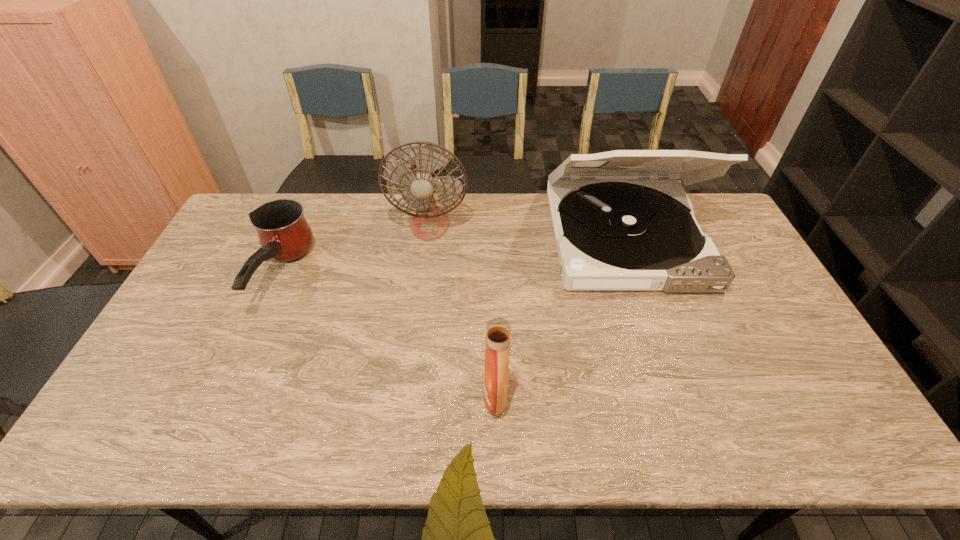
Where is `vacant space at the left edge of the desktop`? vacant space at the left edge of the desktop is located at coordinates (196, 301).

At what (x,y) coordinates should I click in order to perform the action: click on vacant space at the right edge of the desktop. Please return your answer as a coordinate pair (x, y). Looking at the image, I should click on (768, 316).

Where is `vacant space at the far left corner of the desktop`? vacant space at the far left corner of the desktop is located at coordinates (228, 235).

The width and height of the screenshot is (960, 540). Find the location of `vacant space that is in between the detergent and the rightmost object`. vacant space that is in between the detergent and the rightmost object is located at coordinates (561, 317).

Locate an element on the screen. This screenshot has width=960, height=540. free space between the third object from left to right and the rightmost object is located at coordinates (561, 317).

At what (x,y) coordinates should I click in order to perform the action: click on unoccupied position between the detergent and the third object from right to left. Please return your answer as a coordinate pair (x, y). The image size is (960, 540). Looking at the image, I should click on (463, 309).

Find the location of a particular element. The image size is (960, 540). free space between the third object from left to right and the CD player is located at coordinates (561, 317).

Locate an element on the screen. free spot between the detergent and the fan is located at coordinates (463, 309).

Find the location of `vacant area that lies between the rightmost object and the shortest object`. vacant area that lies between the rightmost object and the shortest object is located at coordinates (452, 257).

At what (x,y) coordinates should I click in order to perform the action: click on vacant space that is in between the fan and the leftmost object. Please return your answer as a coordinate pair (x, y). Looking at the image, I should click on (354, 249).